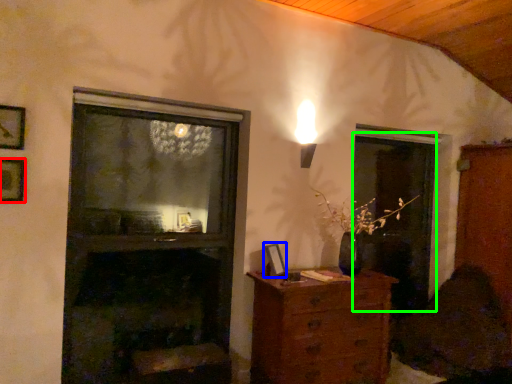
Question: Which is nearer to the picture frame (highlighted by a red box)? picture frame (highlighted by a blue box) or screen door (highlighted by a green box).

Choices:
 (A) picture frame
 (B) screen door

Answer: (A)